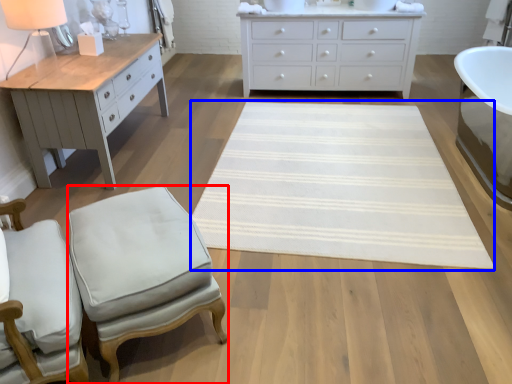
Question: Which of the following is the closest to the observer, stool (highlighted by a red box) or mat (highlighted by a blue box)?

Choices:
 (A) stool
 (B) mat

Answer: (A)